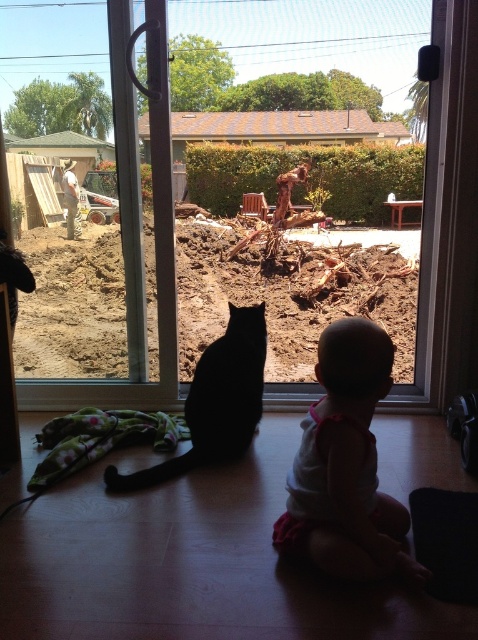
Can you confirm if white fabric baby at center is thinner than black matte cat at center?

Yes, white fabric baby at center is thinner than black matte cat at center.

Which is more to the left, white fabric baby at center or black matte cat at center?

From the viewer's perspective, black matte cat at center appears more on the left side.

Identify the location of white fabric baby at center. The image size is (478, 640). (346, 465).

Which is behind, point (438, 205) or point (249, 326)?

The point (438, 205) is more distant.

Between point (39, 397) and point (130, 484), which one is positioned behind?

Point (39, 397)

This screenshot has height=640, width=478. I want to click on transparent glass window at center, so click(440, 224).

Does transparent glass window at center come behind white fabric baby at center?

That is True.

Is point (162, 323) positioned before point (347, 333)?

That is False.

Locate an element on the screen. The width and height of the screenshot is (478, 640). transparent glass window at center is located at coordinates (440, 224).